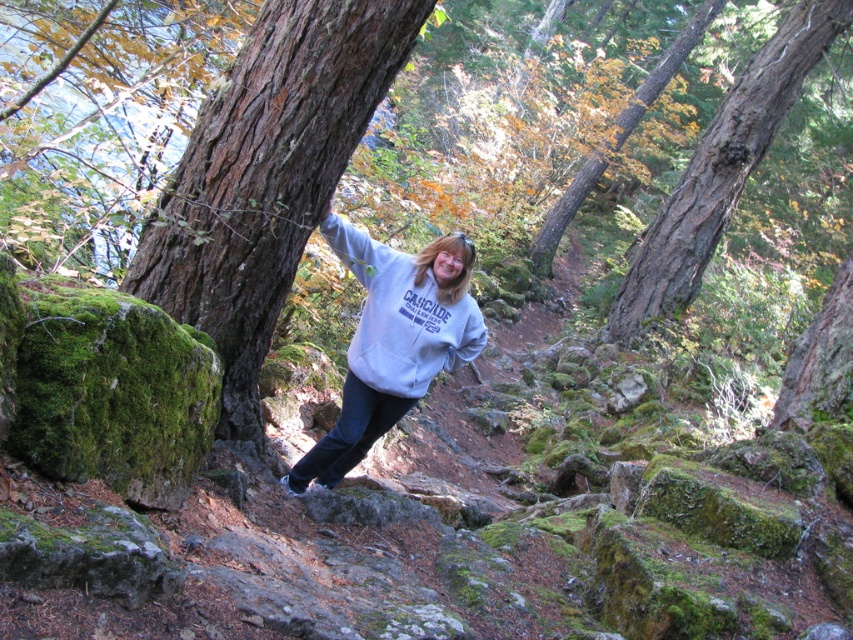
You are a hiker who has just arrived at the rocky trail in the forest. You see a point marked at coordinates (265, 177). What object is located at that point?

The point at coordinates (265, 177) corresponds to the brown rough tree trunk at center.

You are a hiker who wants to take a photo of the brown rough bark at upper right and the smooth bark tree at upper center. Which one should you stand closer to in order to capture both in a single frame?

You should stand closer to the brown rough bark at upper right because it is shorter than the smooth bark tree at upper center, allowing both to fit within the camera frame when positioned appropriately.

You are a hiker who wants to place a 10 meter long rope between the brown rough bark at upper right and the smooth bark tree at upper center. Will the rope be long enough?

The distance between the brown rough bark at upper right and the smooth bark tree at upper center is 8.25 meters. Since the rope is 10 meters long, it will be long enough to span the distance between the brown rough bark at upper right and the smooth bark tree at upper center.